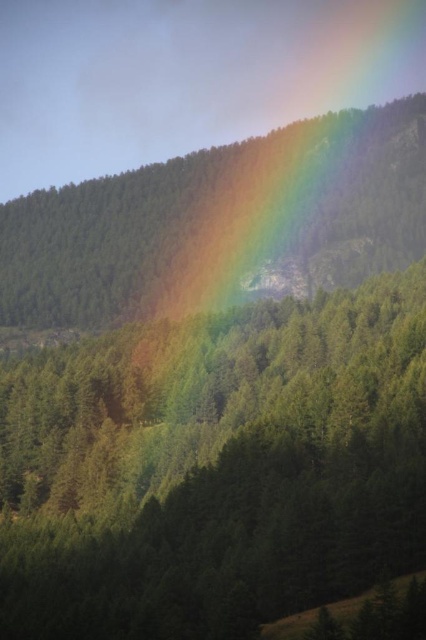
Between green matte tree at center and smooth green forest at upper center, which one has more height?

smooth green forest at upper center

Is point (77, 568) positioned in front of point (334, 129)?

Yes, it is.

Who is more forward, (104, 577) or (135, 292)?

Positioned in front is point (104, 577).

Where is `green matte tree at center`? green matte tree at center is located at coordinates (215, 468).